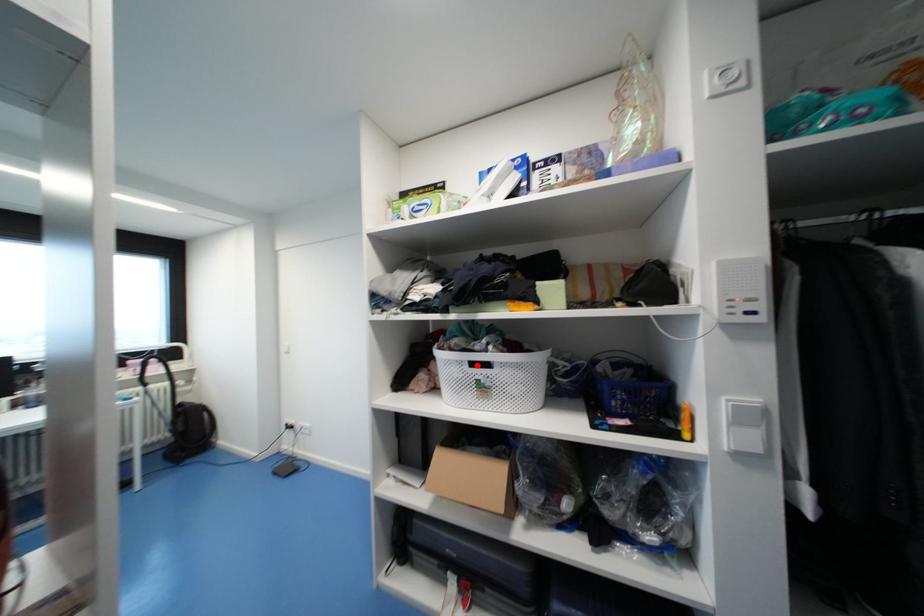
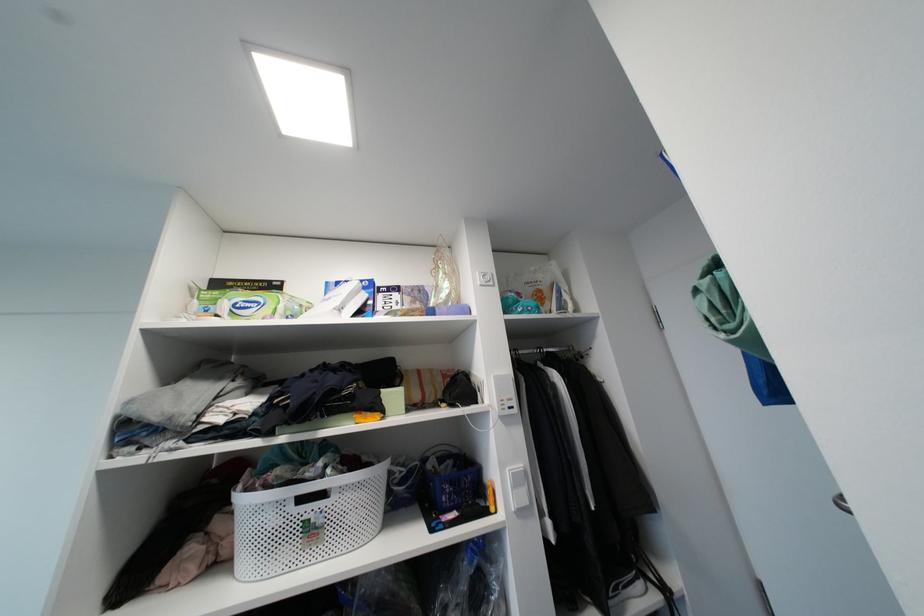
In the second image, find the point that corresponds to the highlighted location in the first image.

(306, 501)